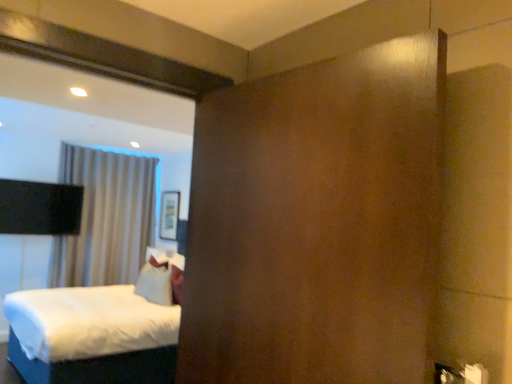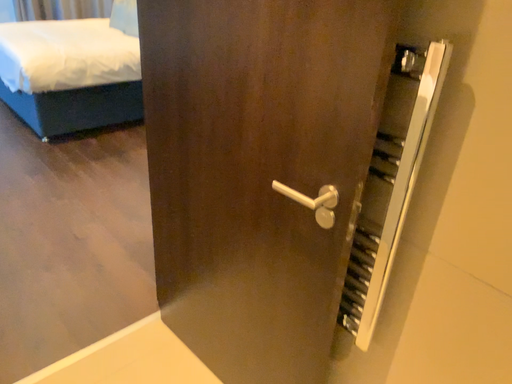
Question: How did the camera likely rotate when shooting the video?

Choices:
 (A) rotated upward
 (B) rotated downward

Answer: (B)